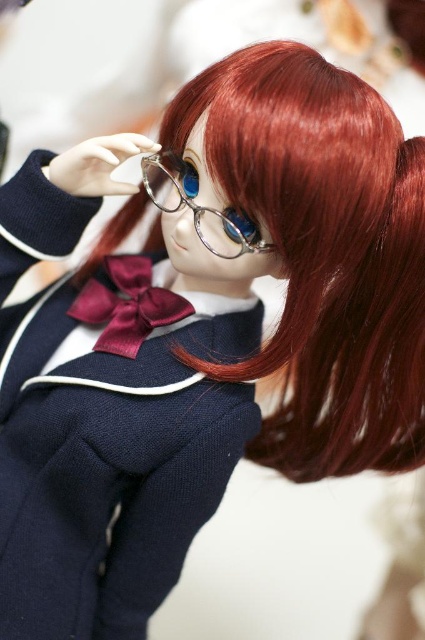
Question: Where is satin burgundy bow tie at center located in relation to clear plastic glasses at center in the image?

Choices:
 (A) below
 (B) above

Answer: (A)

Question: From the image, what is the correct spatial relationship of satin burgundy bow tie at center in relation to clear plastic glasses at center?

Choices:
 (A) above
 (B) below

Answer: (B)

Question: Does satin burgundy bow tie at center appear on the left side of clear plastic glasses at center?

Choices:
 (A) no
 (B) yes

Answer: (B)

Question: Among these points, which one is farthest from the camera?

Choices:
 (A) (146, 326)
 (B) (141, 173)

Answer: (B)